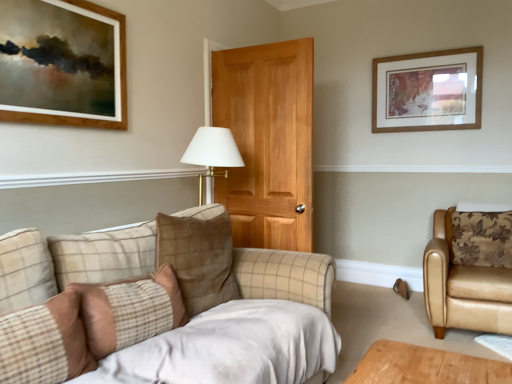
Question: Is tan leather armchair at right positioned before brown checkered pillow at center, which appears as the 2th pillow when viewed from the back?

Choices:
 (A) yes
 (B) no

Answer: (B)

Question: From a real-world perspective, does tan leather armchair at right sit lower than brown checkered pillow at center, which appears as the 2th pillow when viewed from the back?

Choices:
 (A) no
 (B) yes

Answer: (B)

Question: Considering the relative positions of tan leather armchair at right and brown checkered pillow at center, which is the 2th pillow in right-to-left order, in the image provided, is tan leather armchair at right to the right of brown checkered pillow at center, which is the 2th pillow in right-to-left order, from the viewer's perspective?

Choices:
 (A) yes
 (B) no

Answer: (A)

Question: Is tan leather armchair at right aimed at brown checkered pillow at center, which is the 3th pillow in front-to-back order?

Choices:
 (A) no
 (B) yes

Answer: (A)

Question: Can you confirm if tan leather armchair at right is smaller than brown checkered pillow at center, the 3th pillow from the left?

Choices:
 (A) no
 (B) yes

Answer: (A)

Question: Is floral-patterned leather pillow at right, the 1th pillow when ordered from right to left, wider or thinner than brown checkered pillow at center, the 3th pillow from the left?

Choices:
 (A) wide
 (B) thin

Answer: (A)

Question: From the image's perspective, relative to brown checkered pillow at center, which is the 2th pillow in right-to-left order, is floral-patterned leather pillow at right, which appears as the first pillow when viewed from the back, above or below?

Choices:
 (A) below
 (B) above

Answer: (B)

Question: Looking at the image, does floral-patterned leather pillow at right, which appears as the first pillow when viewed from the back, seem bigger or smaller compared to brown checkered pillow at center, the 3th pillow from the left?

Choices:
 (A) big
 (B) small

Answer: (A)

Question: From a real-world perspective, is floral-patterned leather pillow at right, which appears as the first pillow when viewed from the back, positioned above or below brown checkered pillow at center, which appears as the 2th pillow when viewed from the back?

Choices:
 (A) above
 (B) below

Answer: (B)

Question: From the image's perspective, relative to floral-patterned leather pillow at right, which is the fourth pillow in front-to-back order, is wooden framed artwork at upper right above or below?

Choices:
 (A) below
 (B) above

Answer: (B)

Question: In the image, is wooden framed artwork at upper right positioned in front of or behind floral-patterned leather pillow at right, which is the fourth pillow in front-to-back order?

Choices:
 (A) front
 (B) behind

Answer: (B)

Question: Looking at their shapes, would you say wooden framed artwork at upper right is wider or thinner than floral-patterned leather pillow at right, which appears as the first pillow when viewed from the back?

Choices:
 (A) thin
 (B) wide

Answer: (A)

Question: In the image, is wooden framed artwork at upper right on the left side or the right side of floral-patterned leather pillow at right, the fourth pillow when ordered from left to right?

Choices:
 (A) left
 (B) right

Answer: (A)

Question: Considering the positions of point pos(478,286) and point pos(66,321), is point pos(478,286) closer or farther from the camera than point pos(66,321)?

Choices:
 (A) closer
 (B) farther

Answer: (B)

Question: Is tan leather armchair at right taller or shorter than brown plaid pillow at lower left, marked as the 4th pillow in a back-to-front arrangement?

Choices:
 (A) short
 (B) tall

Answer: (B)